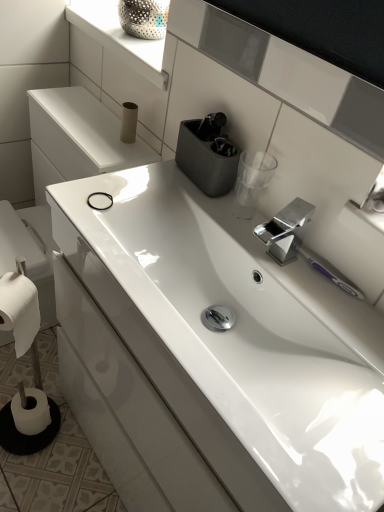
Where is `vacant region to the left of matte gray container at upper center`? The height and width of the screenshot is (512, 384). vacant region to the left of matte gray container at upper center is located at coordinates (143, 178).